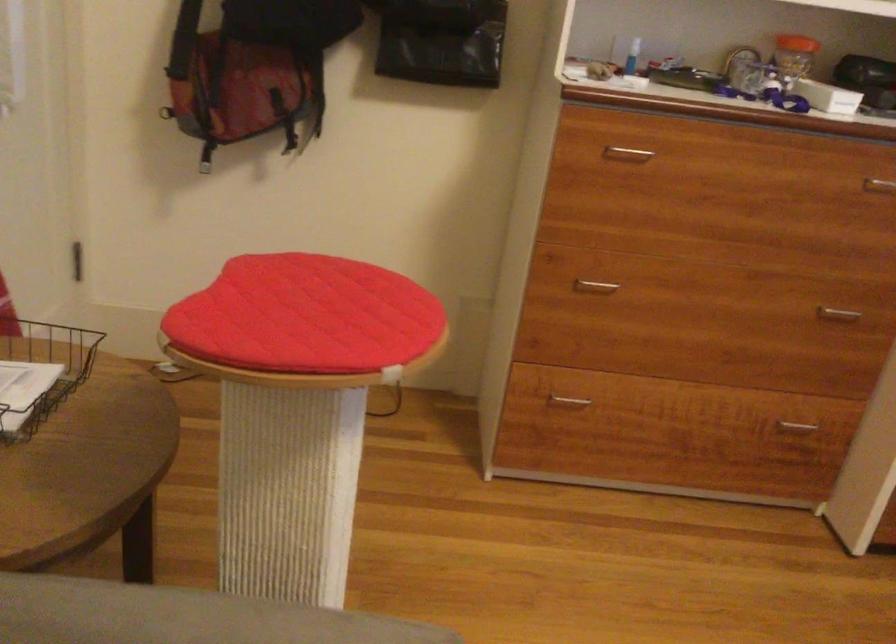
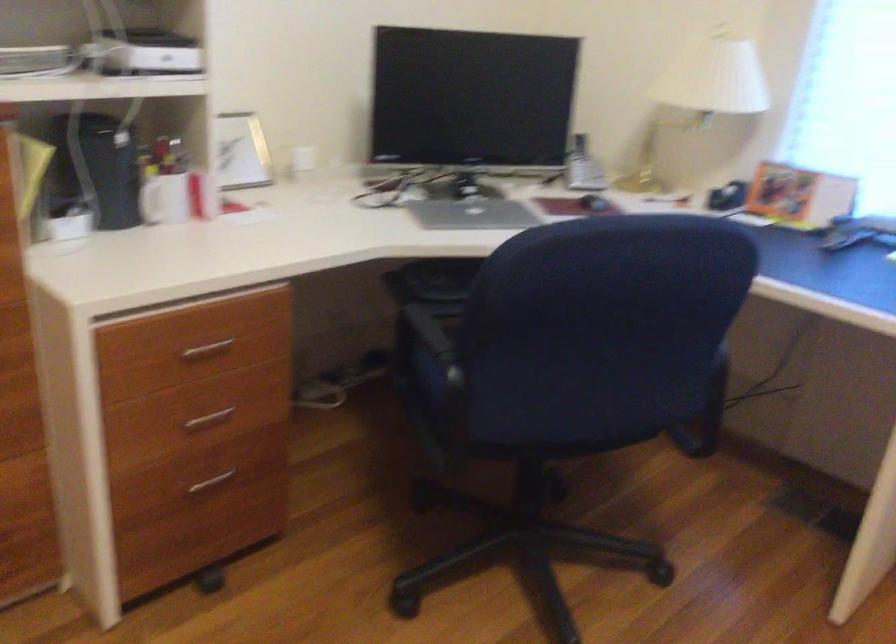
Question: The camera is either moving clockwise (left) or counter-clockwise (right) around the object. The first image is from the beginning of the video and the second image is from the end. Is the camera moving left or right when shooting the video?

Choices:
 (A) Left
 (B) Right

Answer: (A)